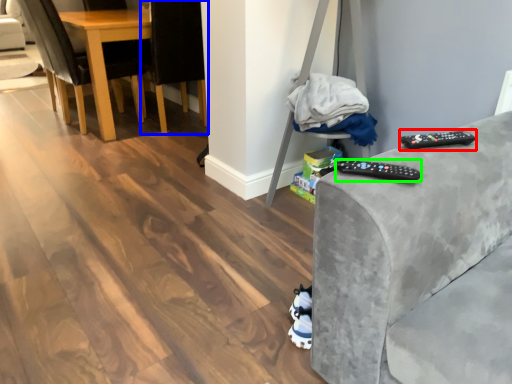
Question: Considering the real-world distances, which object is farthest from remote (highlighted by a red box)? chair (highlighted by a blue box) or remote (highlighted by a green box)?

Choices:
 (A) chair
 (B) remote

Answer: (A)